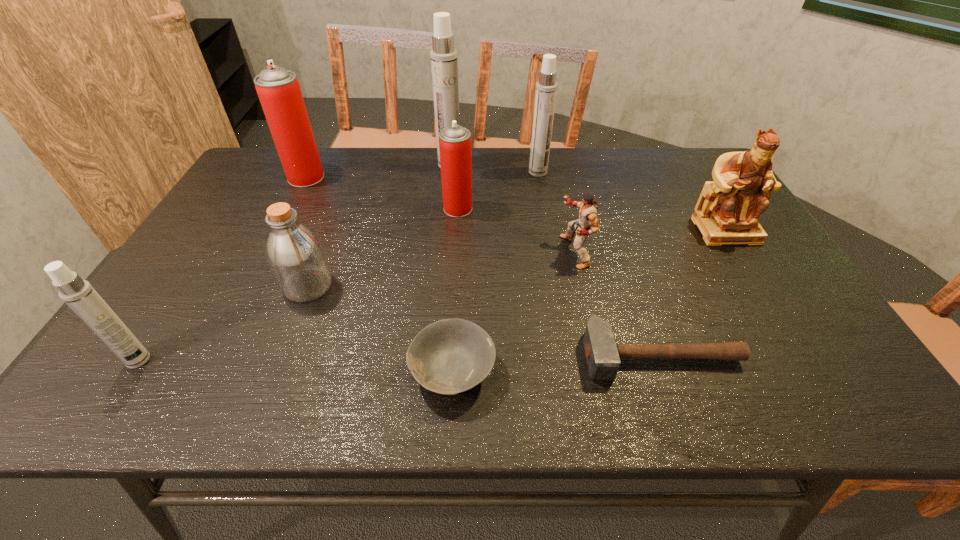
Find the location of a particular element. The image size is (960, 540). the leftmost white aerosol can is located at coordinates (79, 295).

Identify the location of the seventh tallest object. This screenshot has width=960, height=540. (295, 255).

In order to click on bottle in this screenshot , I will do `click(295, 255)`.

The image size is (960, 540). I want to click on the third shortest object, so click(x=583, y=227).

Where is `bowl`? The height and width of the screenshot is (540, 960). bowl is located at coordinates (449, 356).

The image size is (960, 540). Identify the location of hammer. (603, 355).

Locate an element on the screen. This screenshot has height=540, width=960. free spot located 0.120m on the front of the biggest white aerosol can is located at coordinates (447, 192).

Locate an element on the screen. Image resolution: width=960 pixels, height=540 pixels. vacant space situated 0.080m on the front of the farther red aerosol can is located at coordinates (294, 202).

At what (x,y) coordinates should I click in order to perform the action: click on free point located 0.050m on the back of the second smallest white aerosol can. Please return your answer as a coordinate pair (x, y). This screenshot has height=540, width=960. Looking at the image, I should click on (536, 159).

Locate an element on the screen. This screenshot has height=540, width=960. free space located on the front-facing side of the figurine is located at coordinates 781,321.